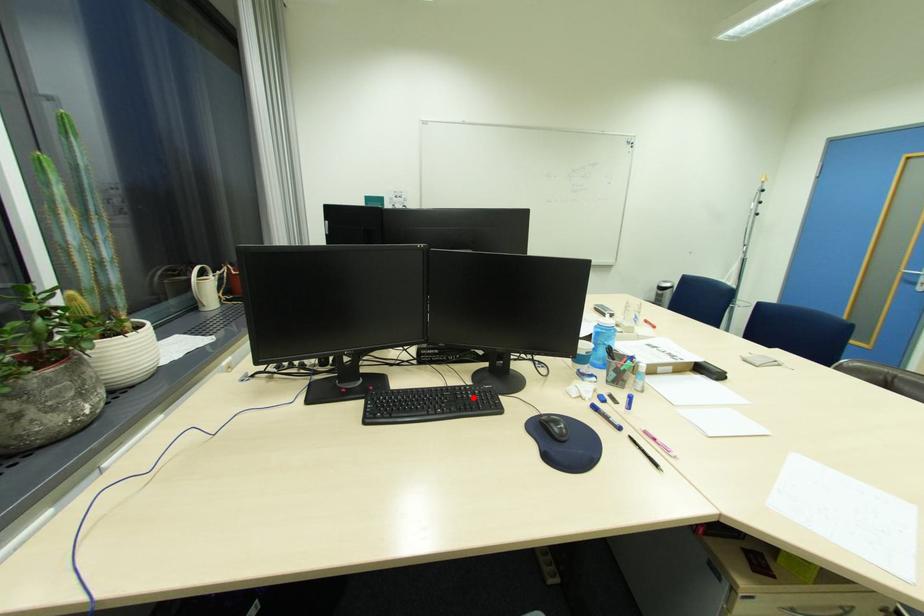
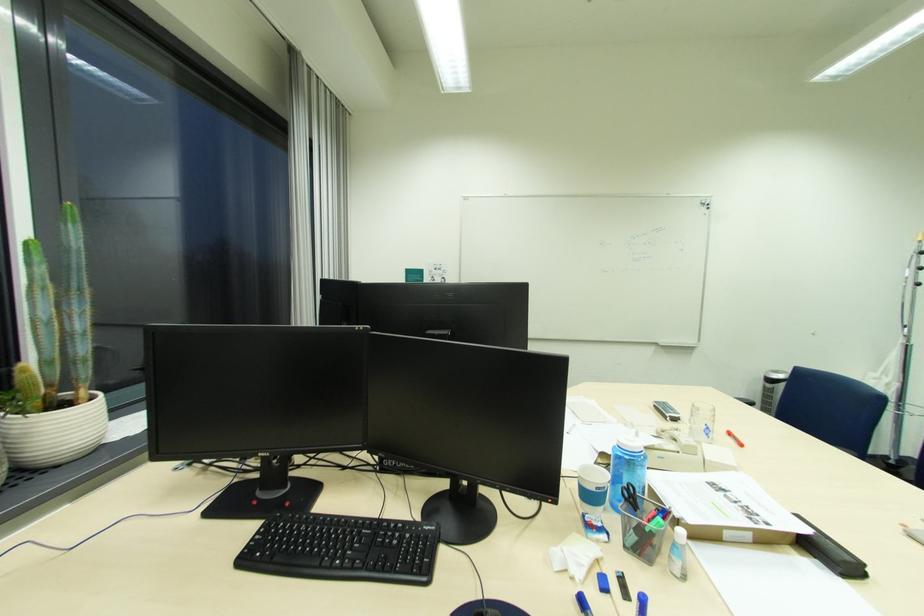
Find the pixel in the second image that matches the highlighted location in the first image.

(396, 541)